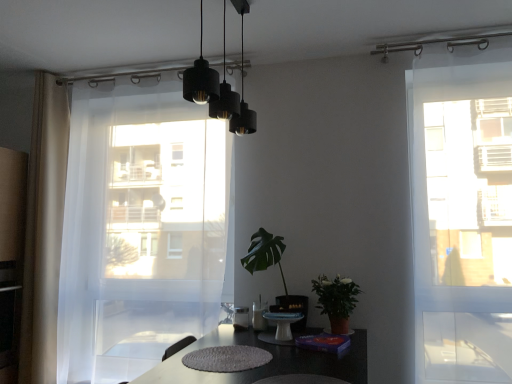
Question: Relative to white sheer curtain at left, positioned as the first curtain in right-to-left order, is green leafy plant at center, which is the second houseplant from right to left, in front or behind?

Choices:
 (A) front
 (B) behind

Answer: (A)

Question: Is green leafy plant at center, which appears as the first houseplant when viewed from the left, situated inside white sheer curtain at left, positioned as the first curtain in right-to-left order, or outside?

Choices:
 (A) inside
 (B) outside

Answer: (B)

Question: Estimate the real-world distances between objects in this image. Which object is closer to the white sheer curtain at left, positioned as the first curtain in right-to-left order?

Choices:
 (A) white sheer curtain at left, which is counted as the first curtain, starting from the left
 (B) green leafy plant at center, which appears as the first houseplant when viewed from the left
 (C) transparent glass door at right
 (D) black matte pendant lights at upper center
 (E) green matte plant at center-right, marked as the second houseplant in a left-to-right arrangement

Answer: (A)

Question: Based on their relative distances, which object is nearer to the white sheer curtain at left, placed as the second curtain when sorted from left to right?

Choices:
 (A) green matte plant at center-right, the 1th houseplant viewed from the right
 (B) green leafy plant at center, which is the second houseplant from right to left
 (C) white sheer curtain at left, which is counted as the first curtain, starting from the left
 (D) transparent glass door at right
 (E) black matte pendant lights at upper center

Answer: (C)